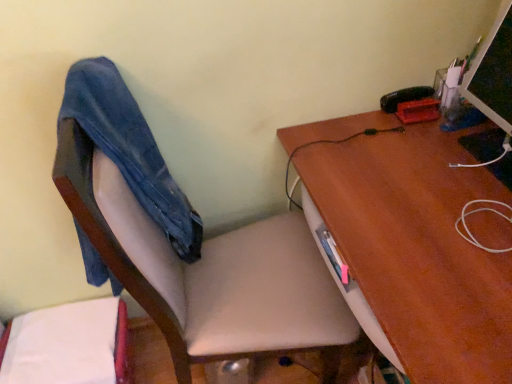
Question: From the image's perspective, is smooth beige chair at center located above or below matte black monitor at upper right?

Choices:
 (A) above
 (B) below

Answer: (B)

Question: From a real-world perspective, is smooth beige chair at center above or below matte black monitor at upper right?

Choices:
 (A) above
 (B) below

Answer: (B)

Question: Considering the real-world distances, which object is closest to the matte black monitor at upper right?

Choices:
 (A) smooth beige chair at center
 (B) brown wood desk at upper right
 (C) denim at left

Answer: (B)

Question: Which of these objects is positioned closest to the smooth beige chair at center?

Choices:
 (A) denim at left
 (B) matte black monitor at upper right
 (C) brown wood desk at upper right

Answer: (A)